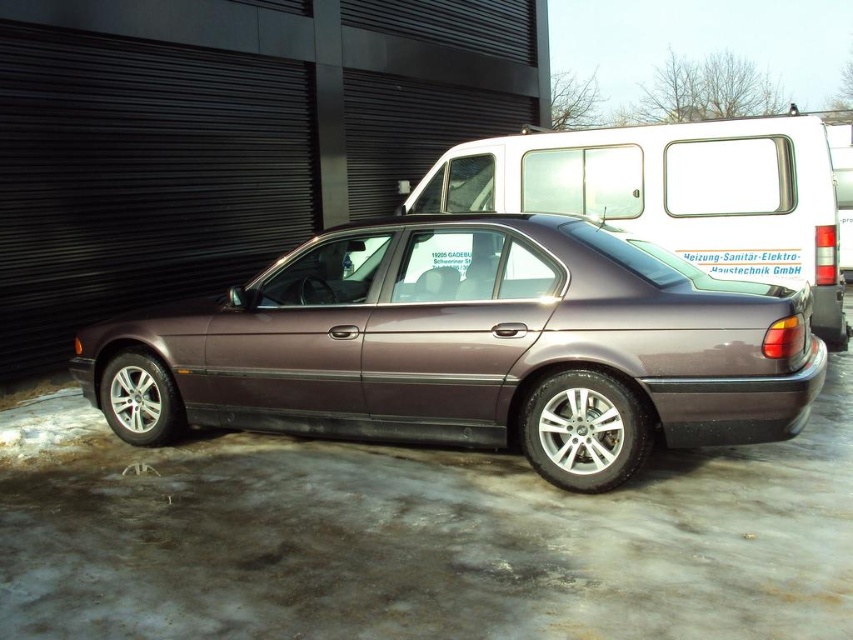
Who is lower down, satin metallic car at center or metallic silver van at center?

satin metallic car at center is lower down.

Who is shorter, satin metallic car at center or metallic silver van at center?

Standing shorter between the two is satin metallic car at center.

Where is `satin metallic car at center`? This screenshot has width=853, height=640. satin metallic car at center is located at coordinates (471, 348).

Identify the location of satin metallic car at center. (471, 348).